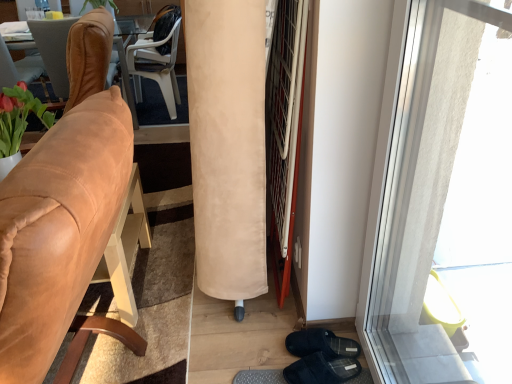
Question: Can you confirm if suede tan chair at left, which is the first chair from front to back, is shorter than brown leather chair at left, positioned as the second chair in front-to-back order?

Choices:
 (A) yes
 (B) no

Answer: (B)

Question: Is suede tan chair at left, which is the first chair from front to back, not within brown leather chair at left, the second chair positioned from the back?

Choices:
 (A) no
 (B) yes

Answer: (B)

Question: Is the position of suede tan chair at left, which is the first chair from front to back, more distant than that of brown leather chair at left, positioned as the second chair in front-to-back order?

Choices:
 (A) yes
 (B) no

Answer: (B)

Question: From the image's perspective, is suede tan chair at left, which is the 3th chair in back-to-front order, on brown leather chair at left, the second chair positioned from the back?

Choices:
 (A) no
 (B) yes

Answer: (A)

Question: Are suede tan chair at left, which is the 3th chair in back-to-front order, and brown leather chair at left, positioned as the second chair in front-to-back order, beside each other?

Choices:
 (A) no
 (B) yes

Answer: (A)

Question: In terms of width, does beige suede curtain at center look wider or thinner when compared to brown leather chair at left, the second chair positioned from the back?

Choices:
 (A) thin
 (B) wide

Answer: (A)

Question: Based on their positions, is beige suede curtain at center located to the left or right of brown leather chair at left, the second chair positioned from the back?

Choices:
 (A) left
 (B) right

Answer: (B)

Question: Which is correct: beige suede curtain at center is inside brown leather chair at left, positioned as the second chair in front-to-back order, or outside of it?

Choices:
 (A) outside
 (B) inside

Answer: (A)

Question: From the image's perspective, relative to brown leather chair at left, the second chair positioned from the back, is beige suede curtain at center above or below?

Choices:
 (A) below
 (B) above

Answer: (A)

Question: From the image's perspective, is transparent glass window at right positioned above or below beige suede curtain at center?

Choices:
 (A) above
 (B) below

Answer: (B)

Question: Is transparent glass window at right wider or thinner than beige suede curtain at center?

Choices:
 (A) wide
 (B) thin

Answer: (B)

Question: Visually, is transparent glass window at right positioned to the left or to the right of beige suede curtain at center?

Choices:
 (A) right
 (B) left

Answer: (A)

Question: Looking at the image, does transparent glass window at right seem bigger or smaller compared to beige suede curtain at center?

Choices:
 (A) small
 (B) big

Answer: (A)

Question: Based on their positions, is brown leather chair at left, the second chair positioned from the back, located to the left or right of beige suede curtain at center?

Choices:
 (A) right
 (B) left

Answer: (B)

Question: In the image, is brown leather chair at left, positioned as the second chair in front-to-back order, positioned in front of or behind beige suede curtain at center?

Choices:
 (A) behind
 (B) front

Answer: (A)